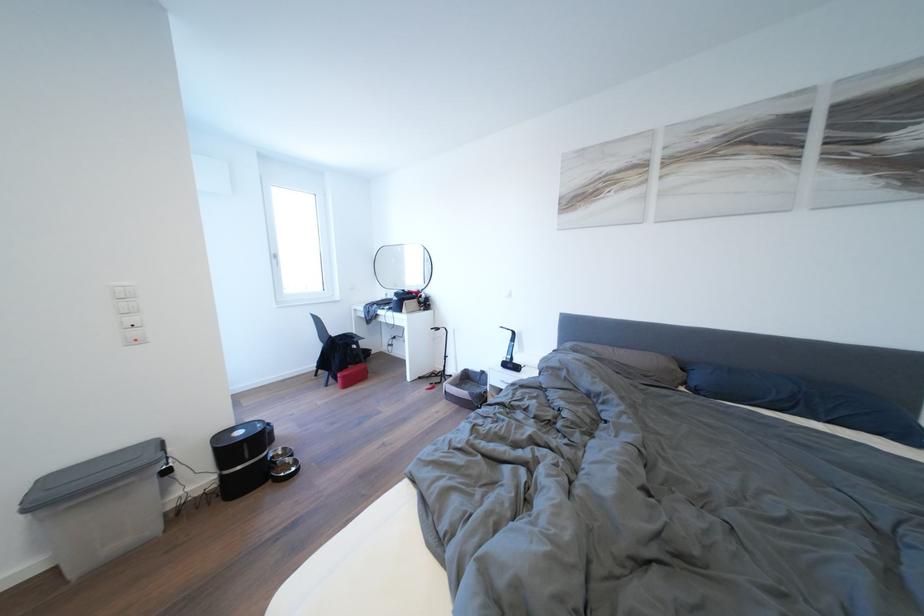
Find where to lift the grey pillow. Please return your answer as a coordinate pair (x, y).

(633, 363)